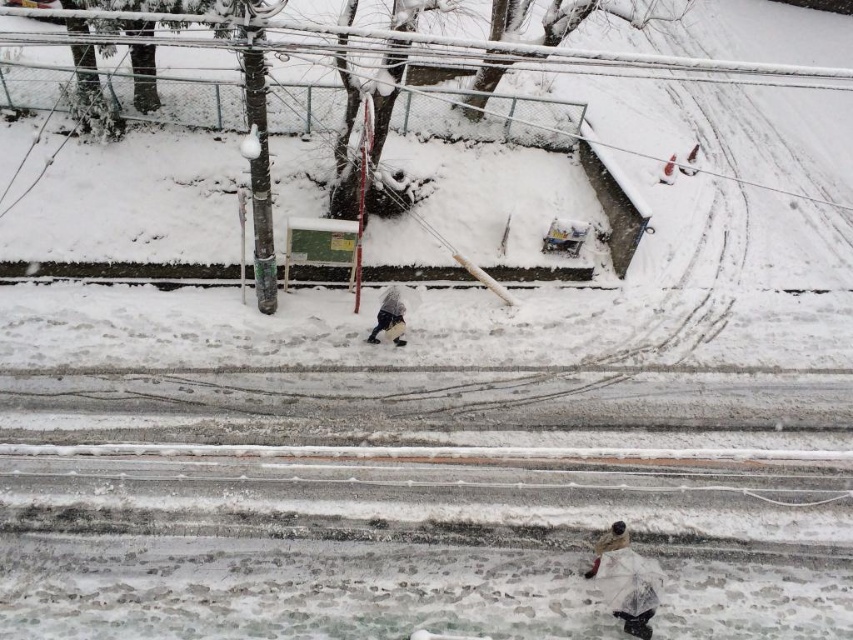
You are standing on a balcony overlooking a snowy street. You notice an object at point (625, 580). What is the object at that location?

The white matte umbrella at lower right is located at point (625, 580).

You are standing on a balcony overlooking the snowy road. You notice a white matte umbrella at lower right. Can you determine if the umbrella is positioned closer to the road or the snowdrift on the sidewalk?

The white matte umbrella at lower right is located at point (625,580), which places it closer to the road than the snowdrift on the sidewalk.

You are standing on a balcony overlooking the snowy road. You see a white matte umbrella at lower right and a dark gray fabric jacket at center. Which object is bigger in size?

The white matte umbrella at lower right is larger in size compared to the dark gray fabric jacket at center according to the description.